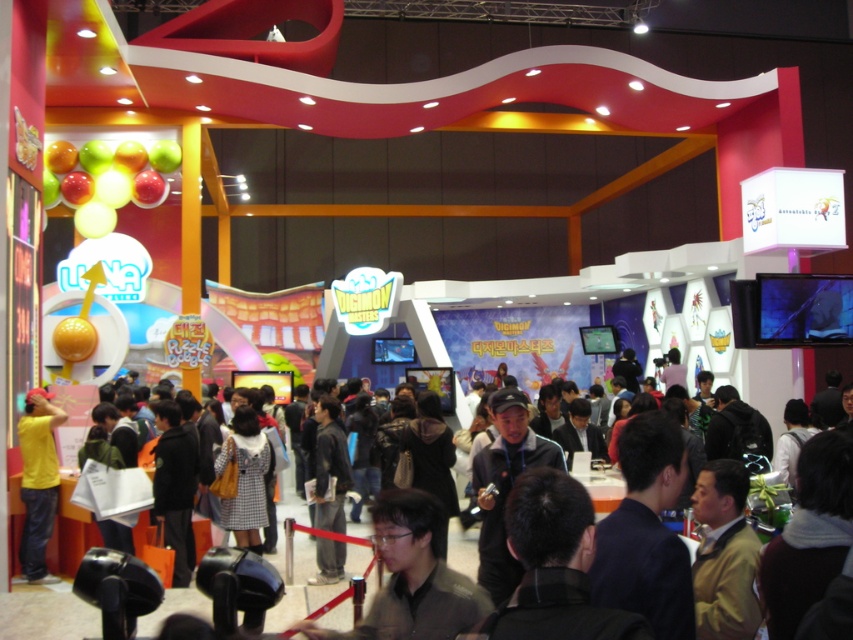
Question: Does dark brown leather jacket at center appear on the left side of yellow matte shirt at left?

Choices:
 (A) no
 (B) yes

Answer: (A)

Question: Which point appears closest to the camera in this image?

Choices:
 (A) 160,612
 (B) 27,397

Answer: (A)

Question: Which point is farther to the camera?

Choices:
 (A) (30, 572)
 (B) (347, 570)

Answer: (B)

Question: Observing the image, what is the correct spatial positioning of dark brown leather jacket at center in reference to yellow matte shirt at left?

Choices:
 (A) right
 (B) left

Answer: (A)

Question: Is dark brown leather jacket at center above yellow matte shirt at left?

Choices:
 (A) yes
 (B) no

Answer: (B)